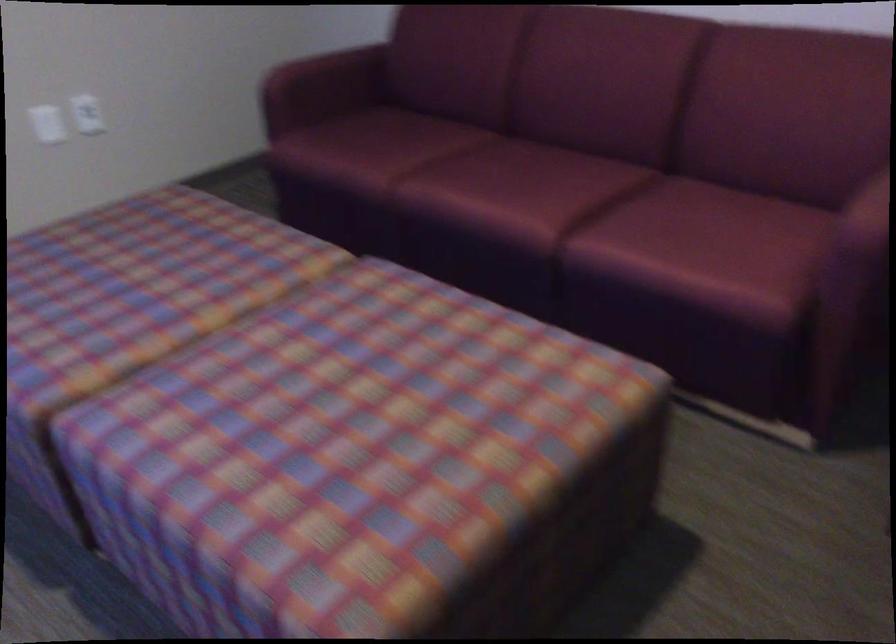
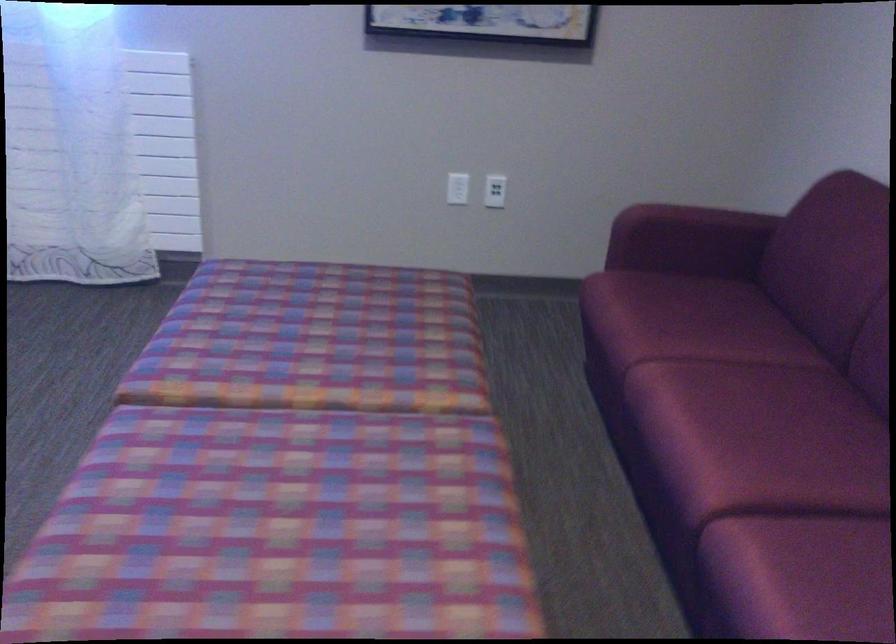
In the second image, find the point that corresponds to (x=82, y=116) in the first image.

(495, 191)